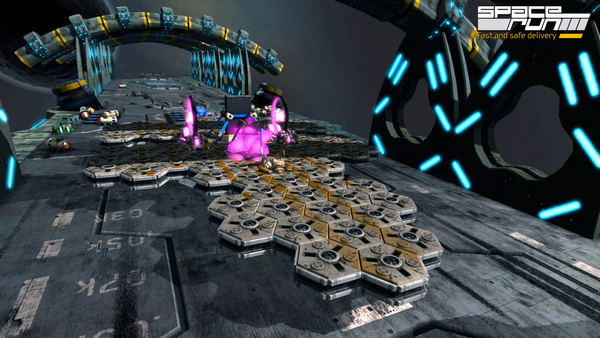
Where is `pink purple light`? This screenshot has width=600, height=338. pink purple light is located at coordinates (189, 122), (246, 142).